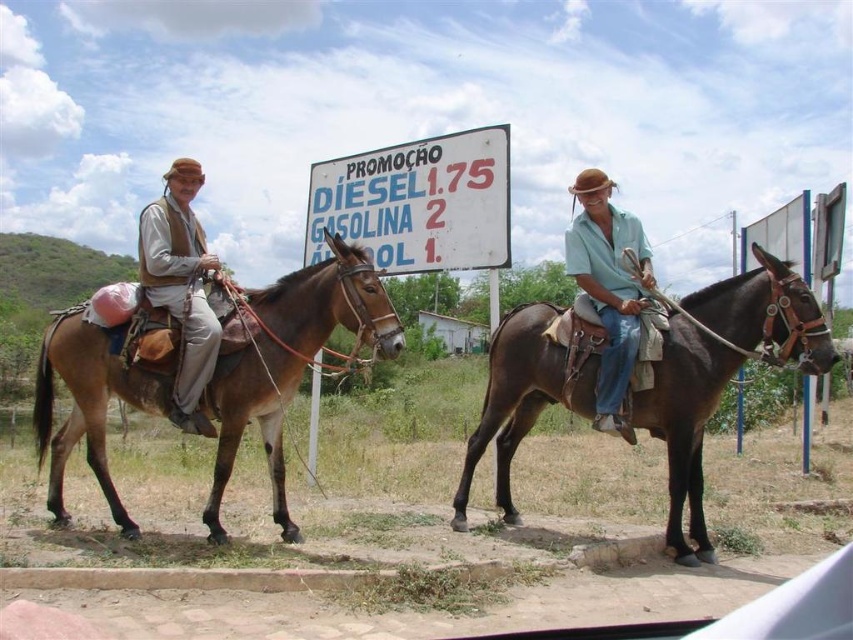
You are a photographer planning to take a photo of the scene. You want to place a marker at the exact position of the brown leather mule at center. What are the coordinates where you should place the marker?

The coordinates for the brown leather mule at center are at point (521, 397).

In the scene shown: You are a photographer trying to capture a photo of the matte teal shirt at center and the brown leather mule at center. From the perspective of the photographer standing behind both subjects, which subject should you adjust to be on the left side of the photo?

The matte teal shirt at center should be moved to the left side of the photo because currently, the brown leather mule at center is positioned to the right of the matte teal shirt at center, meaning the mule is already on the right. To place the shirt on the left, the photographer would need to ensure it is shifted left relative to the mule.